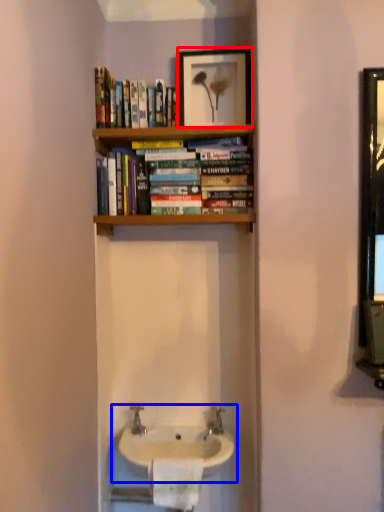
Question: Which point is further to the camera, picture frame (highlighted by a red box) or sink (highlighted by a blue box)?

Choices:
 (A) picture frame
 (B) sink

Answer: (A)